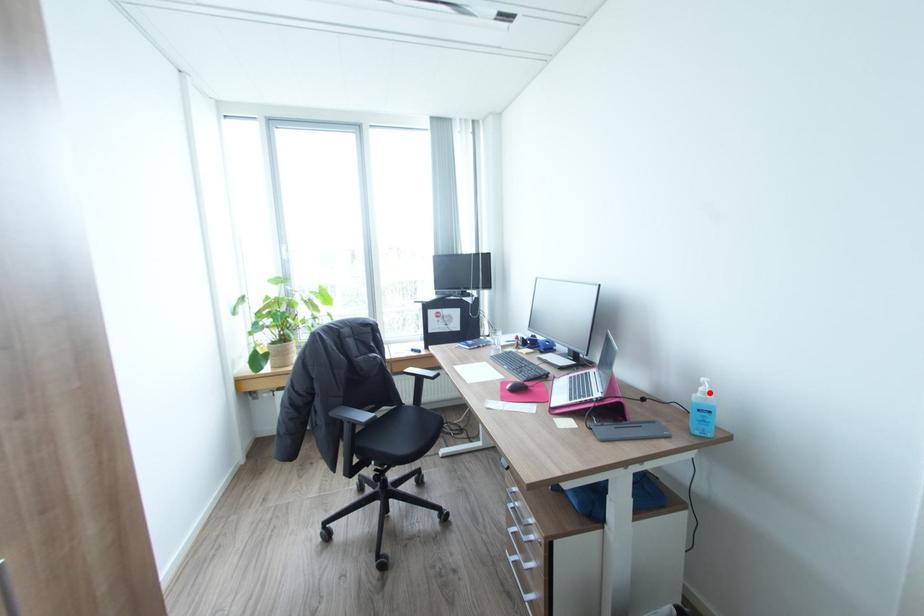
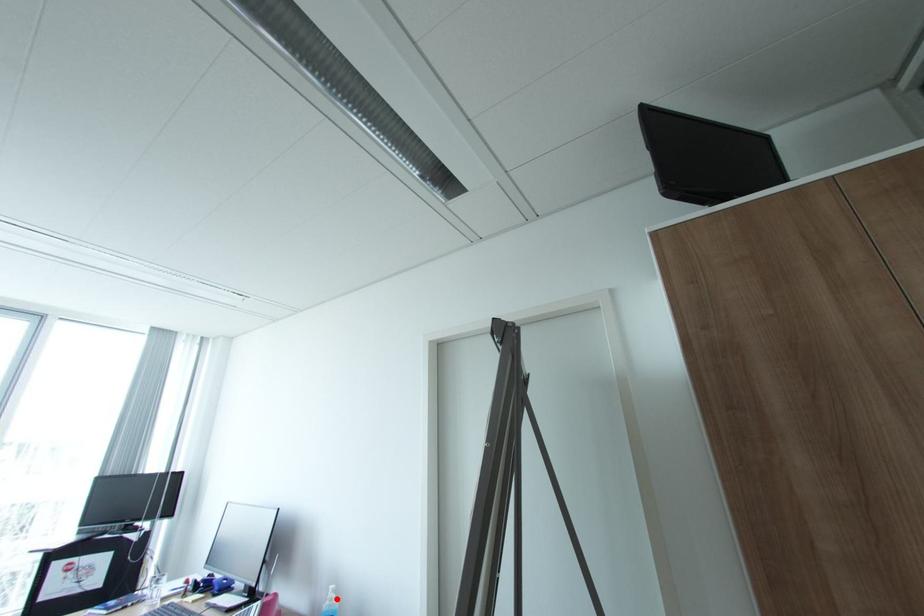
I am providing you with two images of the same scene from different viewpoints. A red point is marked on the first image and another point is marked on the second image. Is the marked point in image1 the same physical position as the marked point in image2?

Yes